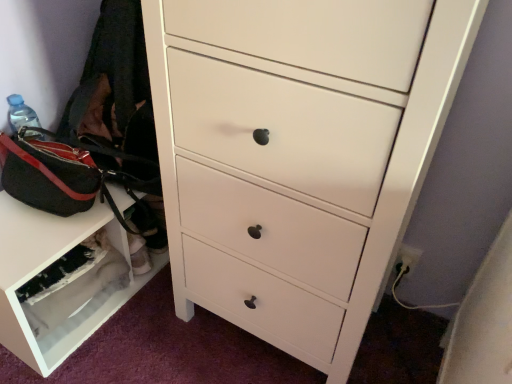
Question: Considering the relative positions of black canvas messenger bag at left and white matte shoe rack at lower left in the image provided, is black canvas messenger bag at left to the left of white matte shoe rack at lower left from the viewer's perspective?

Choices:
 (A) yes
 (B) no

Answer: (B)

Question: Is black canvas messenger bag at left surrounding white matte shoe rack at lower left?

Choices:
 (A) yes
 (B) no

Answer: (B)

Question: Does black canvas messenger bag at left have a smaller size compared to white matte shoe rack at lower left?

Choices:
 (A) no
 (B) yes

Answer: (A)

Question: Is black canvas messenger bag at left closer to camera compared to white matte shoe rack at lower left?

Choices:
 (A) no
 (B) yes

Answer: (B)

Question: Considering the relative sizes of black canvas messenger bag at left and white matte shoe rack at lower left in the image provided, is black canvas messenger bag at left shorter than white matte shoe rack at lower left?

Choices:
 (A) no
 (B) yes

Answer: (B)

Question: From a real-world perspective, does black canvas messenger bag at left sit lower than white matte shoe rack at lower left?

Choices:
 (A) no
 (B) yes

Answer: (A)

Question: Considering the relative sizes of white matte shoe rack at lower left and white glossy chest of drawers at center in the image provided, is white matte shoe rack at lower left taller than white glossy chest of drawers at center?

Choices:
 (A) no
 (B) yes

Answer: (A)

Question: Is white matte shoe rack at lower left positioned in front of white glossy chest of drawers at center?

Choices:
 (A) no
 (B) yes

Answer: (A)

Question: Can we say white matte shoe rack at lower left lies outside white glossy chest of drawers at center?

Choices:
 (A) yes
 (B) no

Answer: (A)

Question: Is white matte shoe rack at lower left smaller than white glossy chest of drawers at center?

Choices:
 (A) yes
 (B) no

Answer: (A)

Question: Are white matte shoe rack at lower left and white glossy chest of drawers at center far apart?

Choices:
 (A) no
 (B) yes

Answer: (A)

Question: Does white matte shoe rack at lower left touch white glossy chest of drawers at center?

Choices:
 (A) no
 (B) yes

Answer: (A)

Question: Would you say white glossy chest of drawers at center is a long distance from white matte shoe rack at lower left?

Choices:
 (A) yes
 (B) no

Answer: (B)